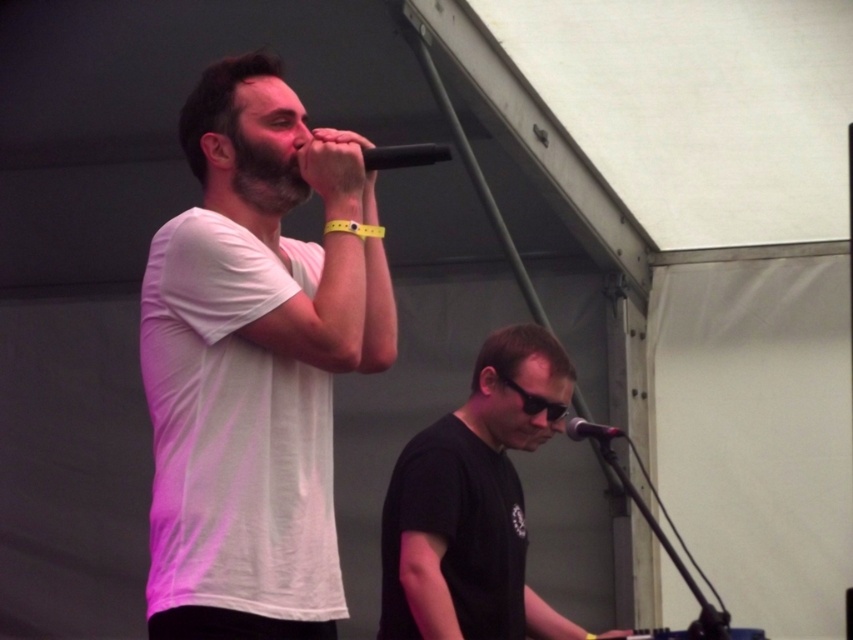
Question: Which of the following is the closest to the observer?

Choices:
 (A) 479,605
 (B) 428,456

Answer: (A)

Question: Does black matte microphone at upper center appear on the left side of black metallic microphone at center?

Choices:
 (A) no
 (B) yes

Answer: (B)

Question: Which point is farther to the camera?

Choices:
 (A) pos(349,224)
 (B) pos(434,499)
 (C) pos(427,157)

Answer: (B)

Question: From the image, what is the correct spatial relationship of white matte t-shirt at center in relation to yellow rubber wristband at upper center?

Choices:
 (A) right
 (B) left

Answer: (B)

Question: Observing the image, what is the correct spatial positioning of black matte shirt at lower right in reference to black metallic microphone at center?

Choices:
 (A) right
 (B) left

Answer: (B)

Question: Which point appears farthest from the camera in this image?

Choices:
 (A) (440, 154)
 (B) (445, 577)
 (C) (576, 440)
 (D) (195, 323)

Answer: (C)